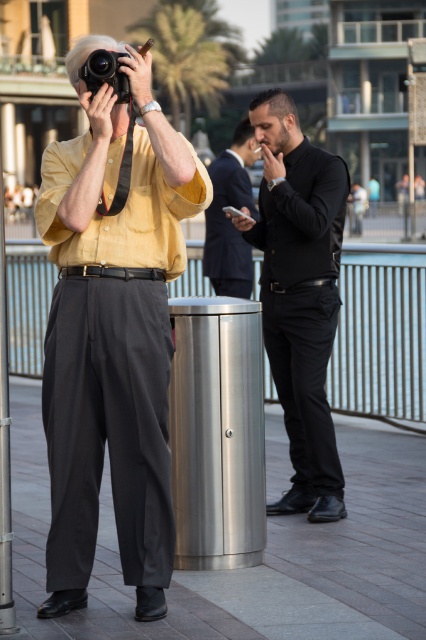
You are a photographer trying to capture a shot of both the older man and the person smoking a cigarette. You notice two points in the scene at coordinates point (324, 358) and point (230, 161). Which point is closer to your camera lens?

Point (324, 358) is closer to the camera than point (230, 161), so you should focus your shot on that point first to ensure both subjects are in frame.

In the scene shown: In the urban waterfront scene, there is a matte yellow shirt at center and a matte black camera at upper left. From the perspective of someone facing the scene, which object is positioned to the left?

The matte black camera at upper left is positioned to the left of the matte yellow shirt at center.